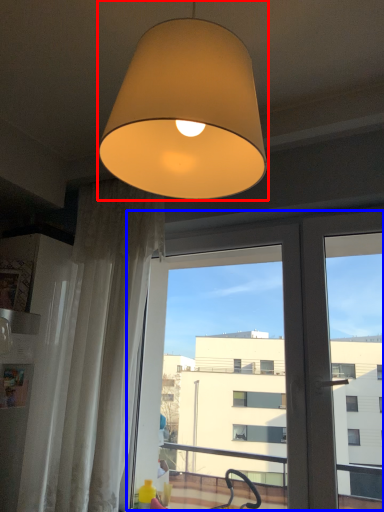
Question: Which of the following is the closest to the observer, lamp (highlighted by a red box) or screen door (highlighted by a blue box)?

Choices:
 (A) lamp
 (B) screen door

Answer: (A)